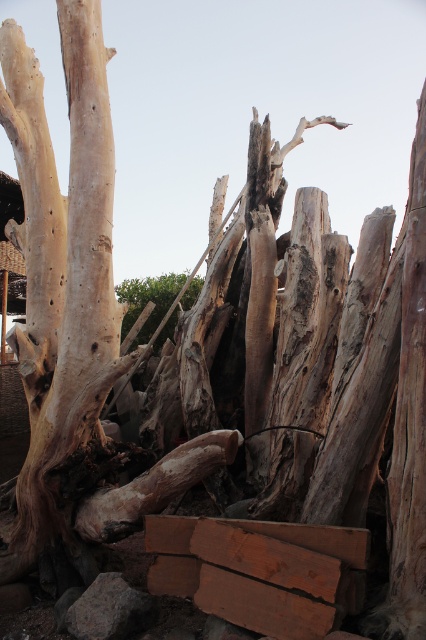
Question: Which object appears closest to the camera in this image?

Choices:
 (A) smooth brown wood at center
 (B) brown rough wood at lower center

Answer: (B)

Question: Does smooth beige wood at left appear on the right side of smooth brown wood at center?

Choices:
 (A) yes
 (B) no

Answer: (B)

Question: Is brown rough wood at lower center closer to camera compared to smooth brown wood at center?

Choices:
 (A) no
 (B) yes

Answer: (B)

Question: Estimate the real-world distances between objects in this image. Which object is closer to the smooth brown wood at center?

Choices:
 (A) brown rough wood at lower center
 (B) smooth beige wood at left

Answer: (B)

Question: Does smooth beige wood at left appear under brown rough wood at lower center?

Choices:
 (A) yes
 (B) no

Answer: (B)

Question: Which point is closer to the camera?

Choices:
 (A) (193, 301)
 (B) (166, 588)
 (C) (0, 40)

Answer: (B)